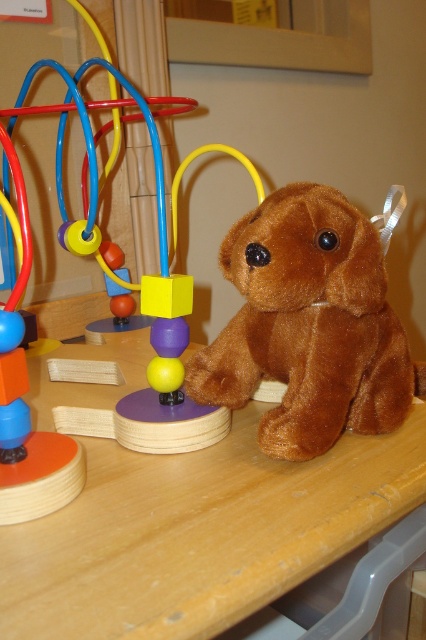
You are organizing a child birthday party and need to arrange the brown plush toy at center and the brown plush bear at right on a shelf. According to the scene, which one should be placed to the left to maintain the correct spatial arrangement?

The brown plush toy at center should be placed to the left of the brown plush bear at right to maintain the correct spatial arrangement because in the scene, the brown plush toy at center is positioned on the right side of the brown plush bear at right.

You are standing at the point closest to the plush toy dog. Which of the two points, point (167,582) or point (141,99), is closer to you?

Point (167,582) is in front of point (141,99), so it is closer to you.